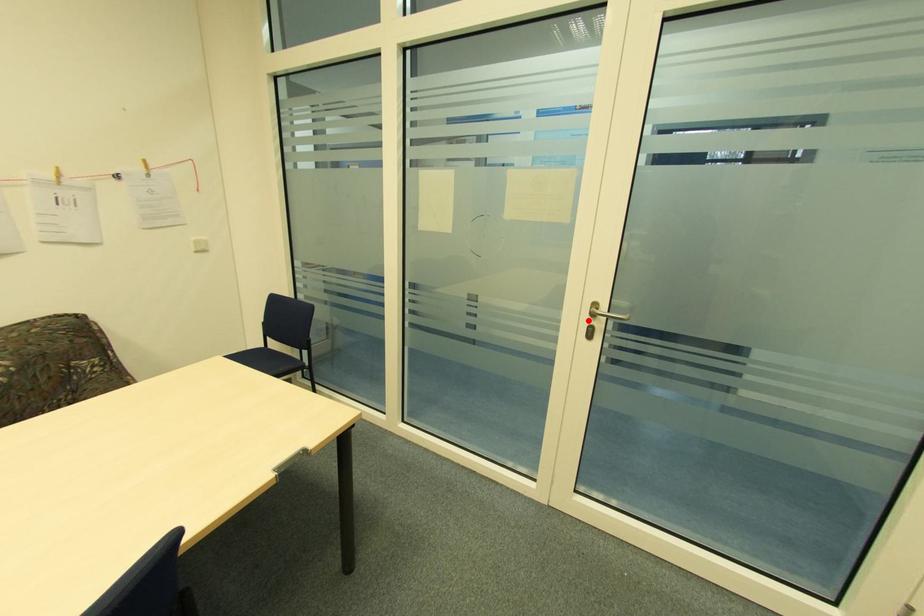
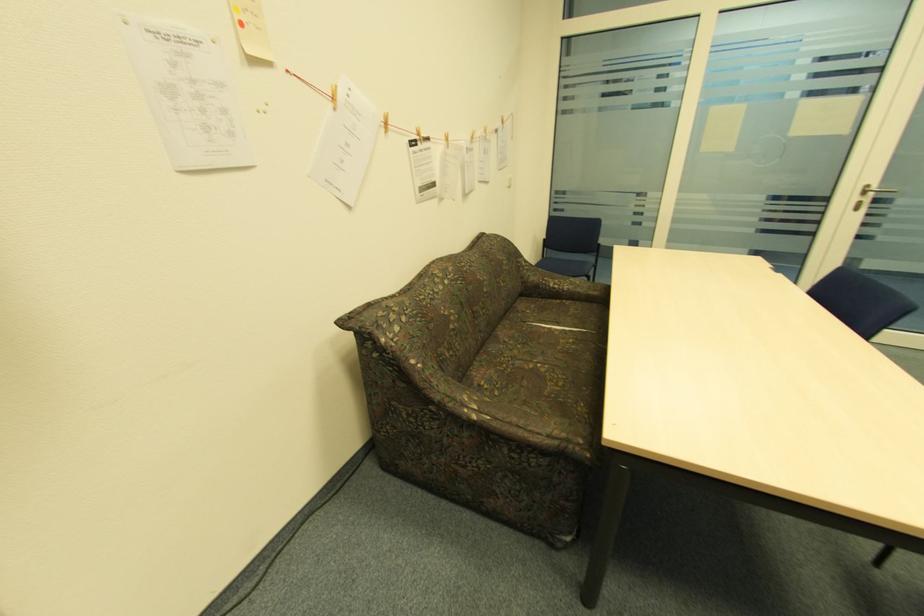
Question: I am providing you with two images of the same scene from different viewpoints. In image1, a red point is highlighted. Considering the same 3D point in image2, which of the following is correct?

Choices:
 (A) It is closer
 (B) It is farther

Answer: (A)